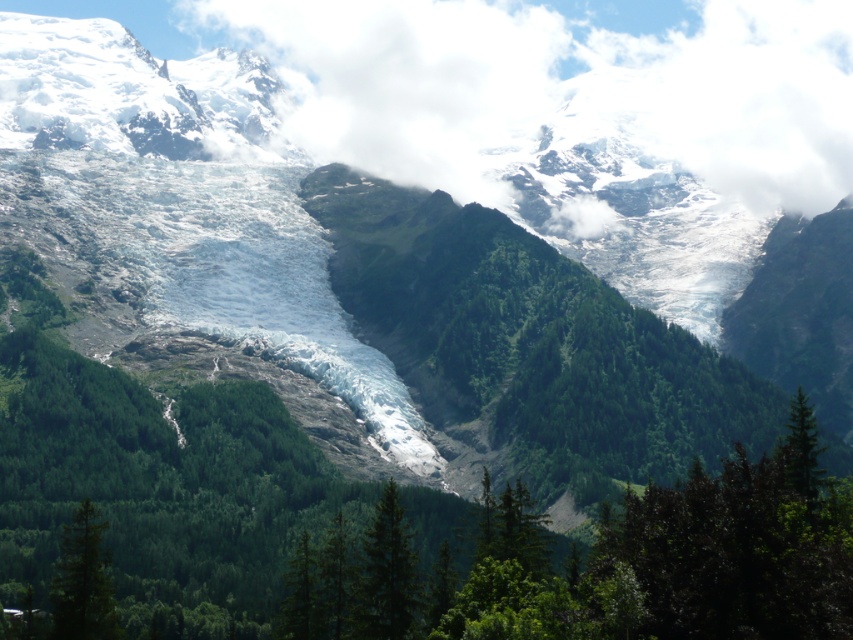
Question: Does white fluffy cloud at upper center have a lesser width compared to green matte tree at lower center?

Choices:
 (A) yes
 (B) no

Answer: (B)

Question: Can you confirm if white fluffy cloud at upper center is bigger than green matte tree at lower center?

Choices:
 (A) yes
 (B) no

Answer: (A)

Question: Which point is farther to the camera?

Choices:
 (A) white fluffy cloud at upper center
 (B) green matte tree at lower left

Answer: (A)

Question: Where is white fluffy cloud at upper center located in relation to green matte tree at lower center in the image?

Choices:
 (A) right
 (B) left

Answer: (A)

Question: Which of these objects is positioned closest to the green matte tree at lower left?

Choices:
 (A) white fluffy cloud at upper center
 (B) green matte tree at lower center

Answer: (B)

Question: Based on their relative distances, which object is farther from the white fluffy cloud at upper center?

Choices:
 (A) green matte tree at lower left
 (B) green matte tree at lower center

Answer: (A)